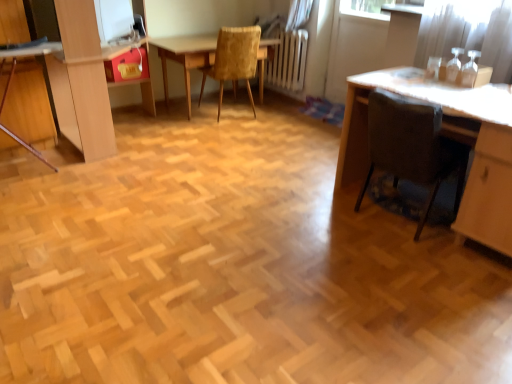
The height and width of the screenshot is (384, 512). Identify the location of free space to the left of brown fabric chair at lower right, the second chair viewed from the left. (319, 213).